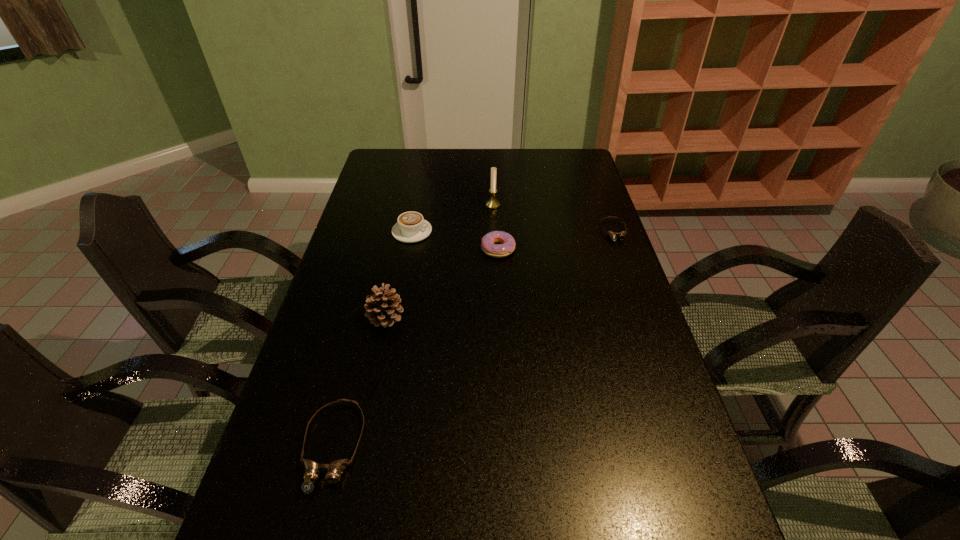
The height and width of the screenshot is (540, 960). In order to click on free space located on the front of the farthest object in this screenshot , I will do `click(495, 274)`.

Find the location of a particular element. vacant space positioned on the left of the doughnut is located at coordinates (376, 249).

Identify the location of blank space located 0.310m with the handle on the right side of the fourth shortest object. The image size is (960, 540). (522, 232).

The width and height of the screenshot is (960, 540). What are the coordinates of `vacant space located 0.280m on the back of the pinecone` in the screenshot? It's located at (401, 242).

At what (x,y) coordinates should I click in order to perform the action: click on object present at the near edge. Please return your answer as a coordinate pair (x, y). Image resolution: width=960 pixels, height=540 pixels. Looking at the image, I should click on (312, 470).

Identify the location of goggles that is positioned at the left edge. Image resolution: width=960 pixels, height=540 pixels. (312, 470).

Identify the location of cappuccino at the left edge. (411, 227).

Identify the location of pinecone at the left edge. (382, 309).

Locate an element on the screen. Image resolution: width=960 pixels, height=540 pixels. object that is at the right edge is located at coordinates (621, 235).

Locate an element on the screen. The height and width of the screenshot is (540, 960). object located at the near left corner is located at coordinates (312, 470).